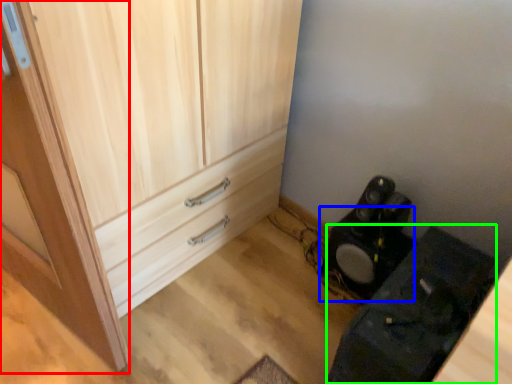
Question: Which object is the closest to the door (highlighted by a red box)? Choose among these: speaker (highlighted by a blue box) or furniture (highlighted by a green box).

Choices:
 (A) speaker
 (B) furniture

Answer: (B)